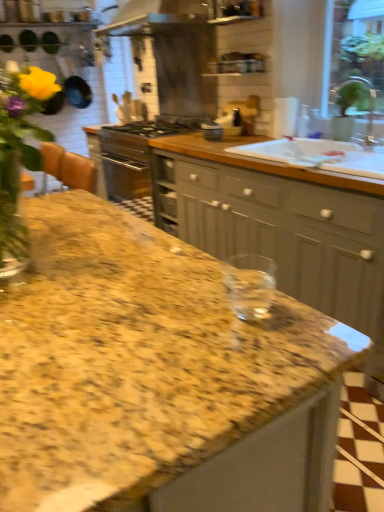
Question: Can you confirm if matte black toaster at center, the 2th appliance viewed from the front, is wider than satin silver exhaust hood at upper center?

Choices:
 (A) yes
 (B) no

Answer: (B)

Question: Is matte black toaster at center, the 2th appliance viewed from the front, bigger than satin silver exhaust hood at upper center?

Choices:
 (A) no
 (B) yes

Answer: (A)

Question: Could you tell me if matte black toaster at center, the 2th appliance viewed from the front, is turned towards satin silver exhaust hood at upper center?

Choices:
 (A) no
 (B) yes

Answer: (A)

Question: Does matte black toaster at center, the 2th appliance viewed from the front, have a lesser width compared to satin silver exhaust hood at upper center?

Choices:
 (A) yes
 (B) no

Answer: (A)

Question: Is matte black toaster at center, the 2th appliance viewed from the front, turned away from satin silver exhaust hood at upper center?

Choices:
 (A) no
 (B) yes

Answer: (A)

Question: From the image's perspective, would you say matte black toaster at center, the 2th appliance viewed from the front, is positioned over satin silver exhaust hood at upper center?

Choices:
 (A) no
 (B) yes

Answer: (A)

Question: Does matte black toaster at center, marked as the 1th appliance in a back-to-front arrangement, turn towards white ceramic sink at upper right?

Choices:
 (A) no
 (B) yes

Answer: (A)

Question: Can you see matte black toaster at center, marked as the 1th appliance in a back-to-front arrangement, touching white ceramic sink at upper right?

Choices:
 (A) no
 (B) yes

Answer: (A)

Question: Is matte black toaster at center, marked as the 1th appliance in a back-to-front arrangement, thinner than white ceramic sink at upper right?

Choices:
 (A) yes
 (B) no

Answer: (A)

Question: Considering the relative sizes of matte black toaster at center, marked as the 1th appliance in a back-to-front arrangement, and white ceramic sink at upper right in the image provided, is matte black toaster at center, marked as the 1th appliance in a back-to-front arrangement, taller than white ceramic sink at upper right?

Choices:
 (A) no
 (B) yes

Answer: (B)

Question: From the image's perspective, is matte black toaster at center, the 2th appliance viewed from the front, over white ceramic sink at upper right?

Choices:
 (A) no
 (B) yes

Answer: (B)

Question: Is matte black toaster at center, the 2th appliance viewed from the front, positioned before white ceramic sink at upper right?

Choices:
 (A) yes
 (B) no

Answer: (B)

Question: Is white ceramic sink at upper right at the left side of matte gray cabinets at center?

Choices:
 (A) no
 (B) yes

Answer: (A)